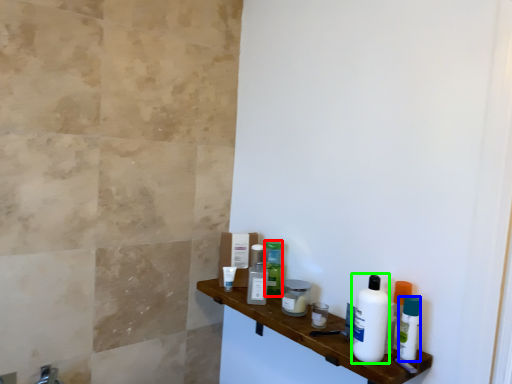
Question: Which object is positioned farthest from toiletry (highlighted by a red box)? Select from mouthwash (highlighted by a blue box) and cleaning product (highlighted by a green box).

Choices:
 (A) mouthwash
 (B) cleaning product

Answer: (A)